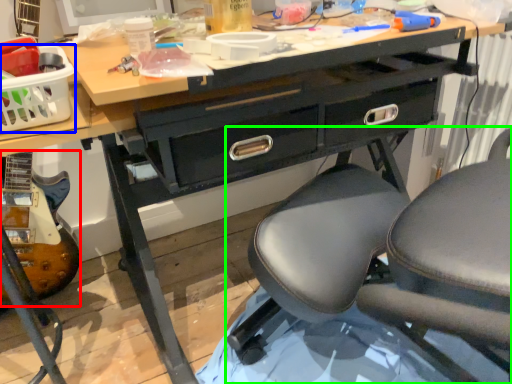
Question: Estimate the real-world distances between objects in this image. Which object is closer to equipment (highlighted by a red box), basket (highlighted by a blue box) or chair (highlighted by a green box)?

Choices:
 (A) basket
 (B) chair

Answer: (A)